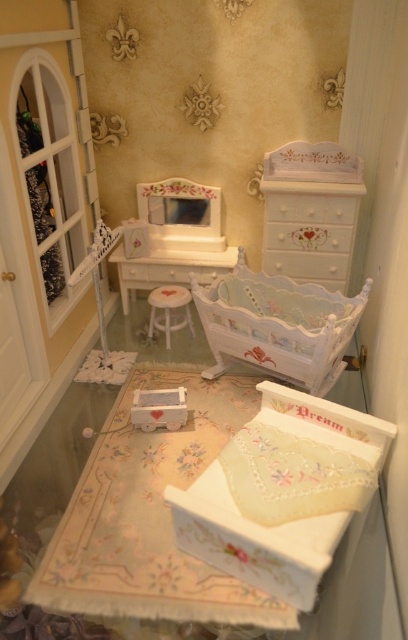
Is the position of white glossy drawers at center less distant than that of white glossy drawer at center?

Yes, it is in front of white glossy drawer at center.

Between white glossy drawers at center and white glossy drawer at center, which one appears on the right side from the viewer's perspective?

From the viewer's perspective, white glossy drawers at center appears more on the right side.

The height and width of the screenshot is (640, 408). I want to click on white glossy drawers at center, so click(308, 234).

Where is `white glossy drawers at center`? Image resolution: width=408 pixels, height=640 pixels. white glossy drawers at center is located at coordinates (308, 234).

Is white painted wood dresser at upper center wider than matte white dresser at center?

In fact, white painted wood dresser at upper center might be narrower than matte white dresser at center.

Is white painted wood dresser at upper center positioned at the back of matte white dresser at center?

No, white painted wood dresser at upper center is closer to the viewer.

I want to click on white painted wood dresser at upper center, so click(310, 208).

Does white glossy drawer at upper center appear under white fabric stool at center?

Incorrect, white glossy drawer at upper center is not positioned below white fabric stool at center.

At what (x,y) coordinates should I click in order to perform the action: click on white glossy drawer at upper center. Please return your answer as a coordinate pair (x, y). The height and width of the screenshot is (640, 408). Looking at the image, I should click on (308, 236).

Does point (337, 243) come closer to viewer compared to point (177, 324)?

That is True.

Locate an element on the screen. The height and width of the screenshot is (640, 408). white glossy drawer at upper center is located at coordinates (308, 236).